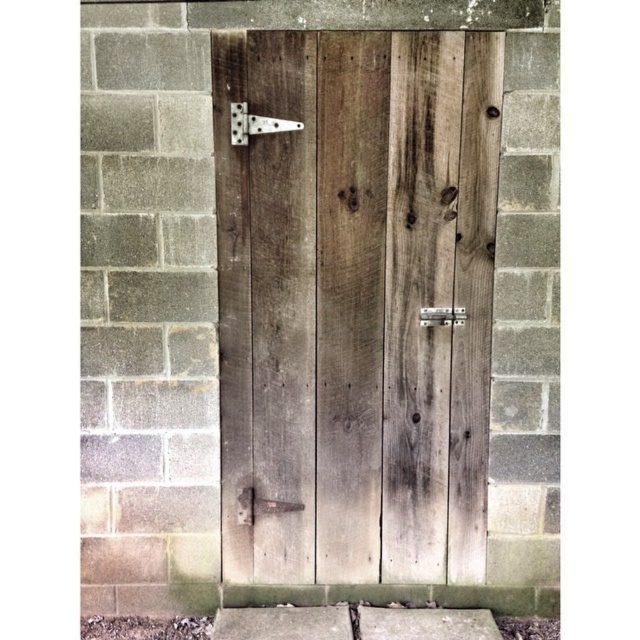
Who is higher up, weathered wood door at center or matte metal hinge at upper left?

matte metal hinge at upper left is above.

Consider the image. Is weathered wood door at center thinner than matte metal hinge at upper left?

No.

The width and height of the screenshot is (640, 640). I want to click on weathered wood door at center, so click(x=356, y=301).

Who is lower down, matte metal hinge at upper left or rusty metal door handle at lower center?

rusty metal door handle at lower center is lower down.

Measure the distance between matte metal hinge at upper left and rusty metal door handle at lower center.

The distance of matte metal hinge at upper left from rusty metal door handle at lower center is 30.05 inches.

Find the location of `matte metal hinge at upper left`. matte metal hinge at upper left is located at coordinates (256, 124).

You are a GUI agent. You are given a task and a screenshot of the screen. Output one action in this format:
    pyautogui.click(x=<x>, y=<y>)
    Task: Click on the matte metal hinge at upper left
    The height and width of the screenshot is (640, 640).
    Given the screenshot: What is the action you would take?
    pyautogui.click(x=256, y=124)

What do you see at coordinates (260, 506) in the screenshot?
I see `rusty metal door handle at lower center` at bounding box center [260, 506].

Does point (292, 504) come farther from viewer compared to point (426, 323)?

Yes.

What do you see at coordinates (260, 506) in the screenshot? The width and height of the screenshot is (640, 640). I see `rusty metal door handle at lower center` at bounding box center [260, 506].

Find the location of a particular element. Image resolution: width=640 pixels, height=640 pixels. rusty metal door handle at lower center is located at coordinates (260, 506).